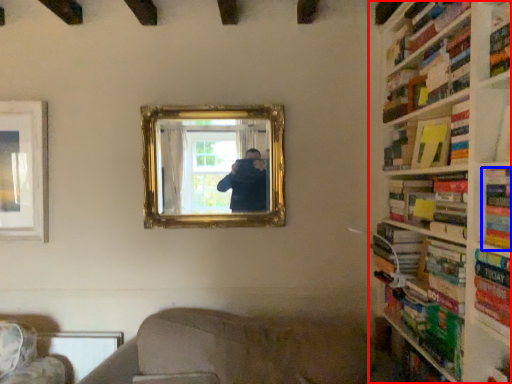
Question: Which object is further to the camera taking this photo, bookcase (highlighted by a red box) or book (highlighted by a blue box)?

Choices:
 (A) bookcase
 (B) book

Answer: (B)